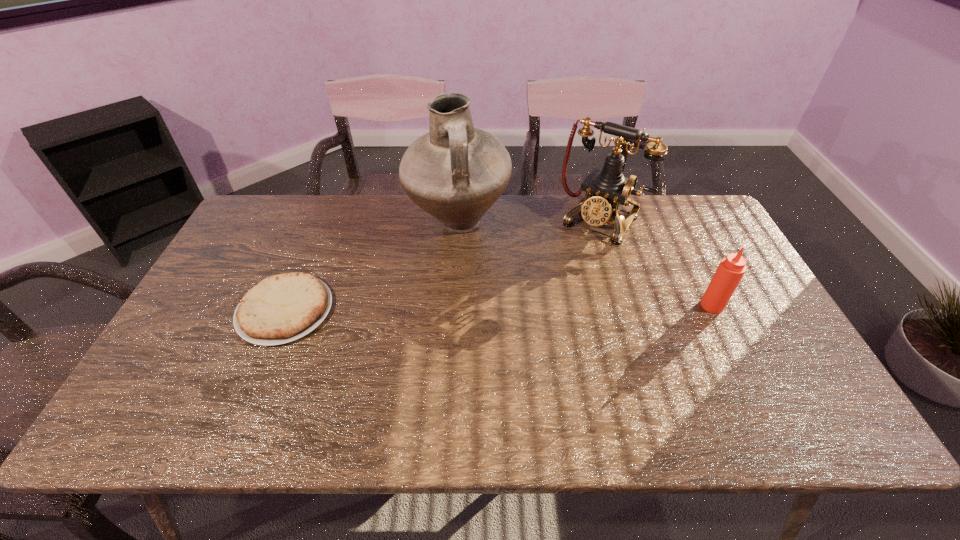
I want to click on vacant area at the far edge of the desktop, so click(332, 221).

Image resolution: width=960 pixels, height=540 pixels. Identify the location of free spot at the near edge of the desktop. (693, 370).

Find the location of a particular element. vacant space at the left edge is located at coordinates (251, 277).

The image size is (960, 540). In the image, there is a desktop. In order to click on vacant space at the right edge in this screenshot , I will do `click(731, 319)`.

What are the coordinates of `free point at the far right corner` in the screenshot? It's located at (681, 201).

Locate an element on the screen. free area in between the third tallest object and the tallest object is located at coordinates (585, 265).

You are a GUI agent. You are given a task and a screenshot of the screen. Output one action in this format:
    pyautogui.click(x=<x>, y=<y>)
    Task: Click on the vacant space in between the Tabasco sauce and the second tallest object
    
    Given the screenshot: What is the action you would take?
    pyautogui.click(x=657, y=263)

This screenshot has width=960, height=540. Identify the location of vacant space that's between the tallest object and the second shortest object. (585, 265).

Locate an element on the screen. The image size is (960, 540). free point between the rightmost object and the second object from right to left is located at coordinates (657, 263).

Identify the location of vacant space in between the third object from left to right and the leftmost object. This screenshot has width=960, height=540. (444, 266).